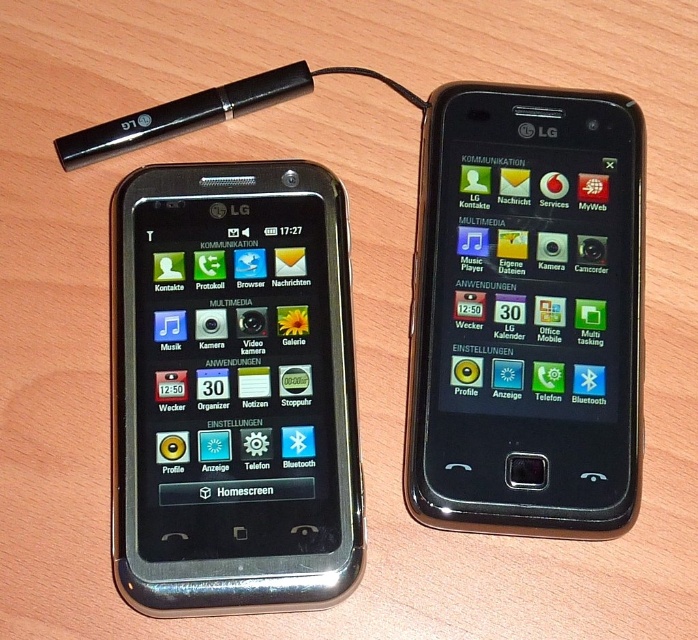
Which is behind, point (265, 458) or point (586, 493)?

Positioned behind is point (265, 458).

Can you confirm if black glossy smartphone at left is positioned below black glossy smartphone at center?

Indeed, black glossy smartphone at left is positioned under black glossy smartphone at center.

Who is more forward, (205, 196) or (537, 173)?

Point (205, 196) is in front.

Find the location of `black glossy smartphone at left`. black glossy smartphone at left is located at coordinates pos(232,388).